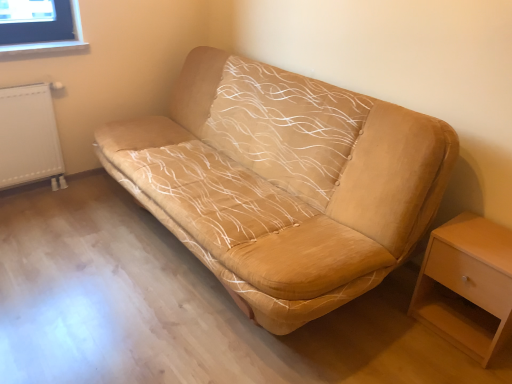
Image resolution: width=512 pixels, height=384 pixels. In order to click on vacant position to the left of light wood/wooden nightstand at lower right in this screenshot , I will do `click(393, 329)`.